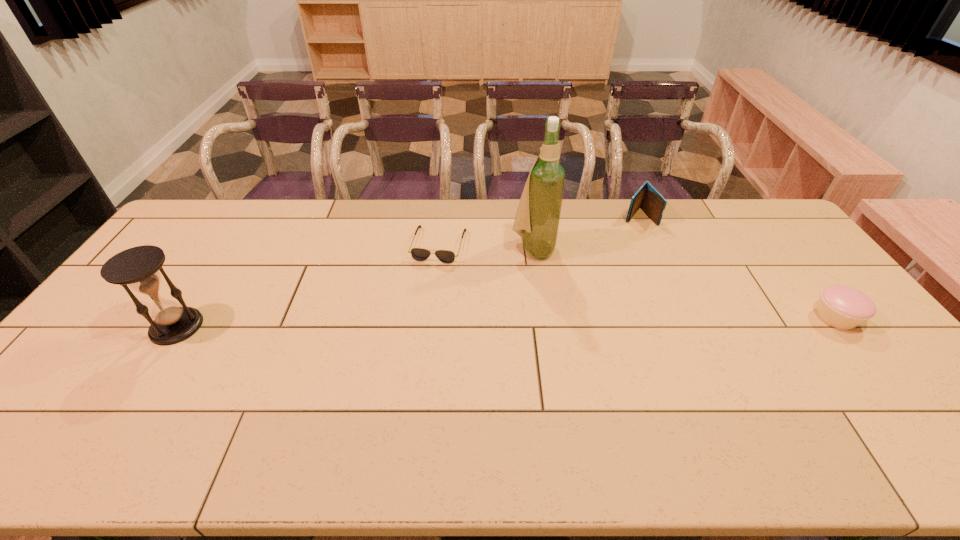
You are a GUI agent. You are given a task and a screenshot of the screen. Output one action in this format:
    pyautogui.click(x=<x>, y=<y>)
    Task: Click on the vacant area situated on the right of the fourth shortest object
    
    Given the screenshot: What is the action you would take?
    pyautogui.click(x=254, y=327)

This screenshot has width=960, height=540. In order to click on free space located on the left of the second shortest object in this screenshot , I will do `click(711, 318)`.

Identify the location of vacant space situated 0.120m on the front-facing side of the third object from left to right. (567, 284).

Find the location of a particular element. vacant space situated on the front-facing side of the third object from left to right is located at coordinates (612, 327).

The image size is (960, 540). In order to click on free location located 0.330m on the front-facing side of the third object from left to right in this screenshot , I will do `click(613, 329)`.

This screenshot has height=540, width=960. What are the coordinates of `vacant space located 0.220m on the exterior surface of the wallet` in the screenshot? It's located at (606, 256).

Find the location of a particular element. This screenshot has width=960, height=540. blank space located 0.050m on the exterior surface of the wallet is located at coordinates (627, 231).

At what (x,y) coordinates should I click in order to perform the action: click on free region located on the exterior surface of the wallet. Please return your answer as a coordinate pair (x, y). This screenshot has height=540, width=960. Looking at the image, I should click on (611, 250).

Find the location of a particular element. Image resolution: width=960 pixels, height=540 pixels. free space located 0.380m on the front-facing side of the second object from left to right is located at coordinates (404, 359).

Where is `free region located 0.310m on the front-facing side of the second object from left to right`? free region located 0.310m on the front-facing side of the second object from left to right is located at coordinates (411, 338).